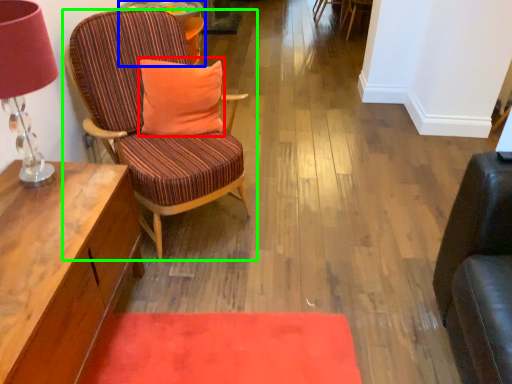
Question: Considering the real-world distances, which object is closest to pillow (highlighted by a red box)? side table (highlighted by a blue box) or chair (highlighted by a green box).

Choices:
 (A) side table
 (B) chair

Answer: (B)